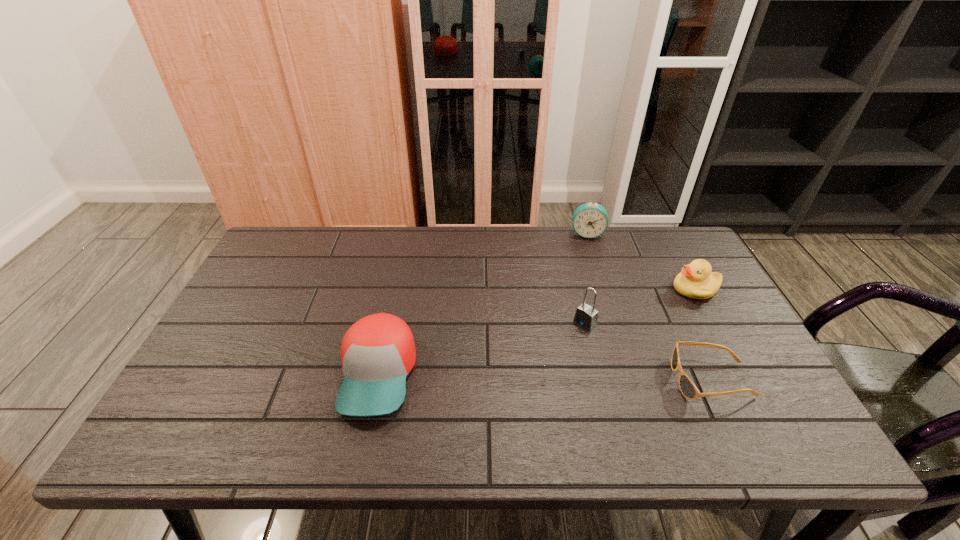
The image size is (960, 540). What are the coordinates of `sunglasses that is at the right edge` in the screenshot? It's located at (688, 389).

Find the location of a particular element. The height and width of the screenshot is (540, 960). duckling that is at the right edge is located at coordinates (696, 281).

Find the location of a particular element. The height and width of the screenshot is (540, 960). object that is at the near right corner is located at coordinates tap(688, 389).

At what (x,y) coordinates should I click in order to perform the action: click on vacant region at the far edge. Please return your answer as a coordinate pair (x, y). Looking at the image, I should click on (498, 241).

Where is `vacant area at the far left corner of the desktop`? This screenshot has width=960, height=540. vacant area at the far left corner of the desktop is located at coordinates (280, 259).

In the image, there is a desktop. Where is `vacant region at the near left corner`? vacant region at the near left corner is located at coordinates (203, 404).

In order to click on free space at the far right corner in this screenshot , I will do `click(673, 262)`.

At what (x,y) coordinates should I click in order to perform the action: click on free spot between the farthest object and the shortest object. Please return your answer as a coordinate pair (x, y). This screenshot has width=960, height=540. Looking at the image, I should click on (649, 307).

Identify the location of vacant space that's between the sunglasses and the baseball cap. (545, 377).

Locate an element on the screen. Image resolution: width=960 pixels, height=540 pixels. free space between the padlock and the fourth nearest object is located at coordinates (640, 306).